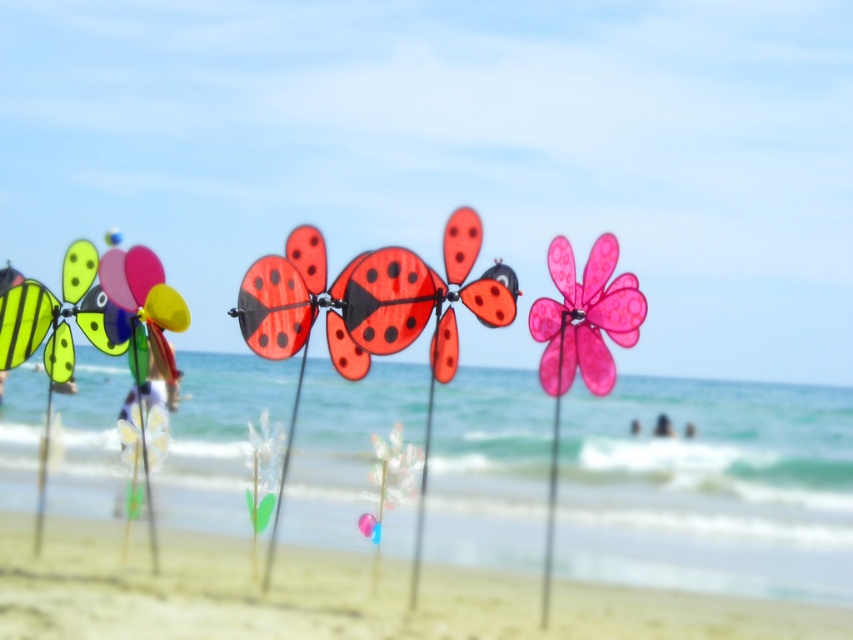
Can you confirm if pink matte flower at center is thinner than shiny red plastic butterfly at center?

Yes, pink matte flower at center is thinner than shiny red plastic butterfly at center.

Can you confirm if pink matte flower at center is taller than shiny red plastic butterfly at center?

Yes.

Locate an element on the screen. pink matte flower at center is located at coordinates (584, 317).

The height and width of the screenshot is (640, 853). I want to click on pink matte flower at center, so click(x=584, y=317).

Which is below, smooth sand at lower center or pink matte flower at center?

smooth sand at lower center is lower down.

Locate an element on the screen. The image size is (853, 640). smooth sand at lower center is located at coordinates (335, 595).

Between point (532, 602) and point (639, 305), which one is positioned in front?

Point (639, 305) is in front.

The image size is (853, 640). In order to click on smooth sand at lower center in this screenshot , I will do `click(335, 595)`.

Can you confirm if yellow-green striped butterfly at left is positioned to the left of translucent plastic flower at center?

Indeed, yellow-green striped butterfly at left is positioned on the left side of translucent plastic flower at center.

Does yellow-green striped butterfly at left have a lesser width compared to translucent plastic flower at center?

In fact, yellow-green striped butterfly at left might be wider than translucent plastic flower at center.

Which is behind, point (3, 342) or point (393, 476)?

The point (3, 342) is behind.

Where is `yellow-green striped butterfly at left`? The width and height of the screenshot is (853, 640). yellow-green striped butterfly at left is located at coordinates (57, 314).